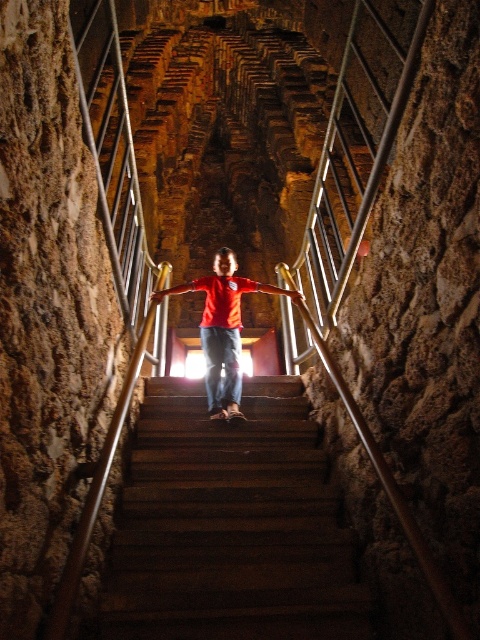
Which is behind, point (276, 580) or point (207, 284)?

The point (207, 284) is more distant.

Is wooden stairs at center positioned behind matte red shirt at center?

No, wooden stairs at center is closer to the viewer.

Does point (156, 435) come in front of point (177, 291)?

Yes, point (156, 435) is in front of point (177, 291).

You are a GUI agent. You are given a task and a screenshot of the screen. Output one action in this format:
    pyautogui.click(x=<x>, y=<y>)
    Task: Click on the wooden stairs at center
    
    Given the screenshot: What is the action you would take?
    pyautogui.click(x=229, y=524)